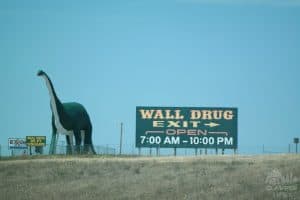
Find the location of a particular element. large "wall drug" sign is located at coordinates point(234,127).